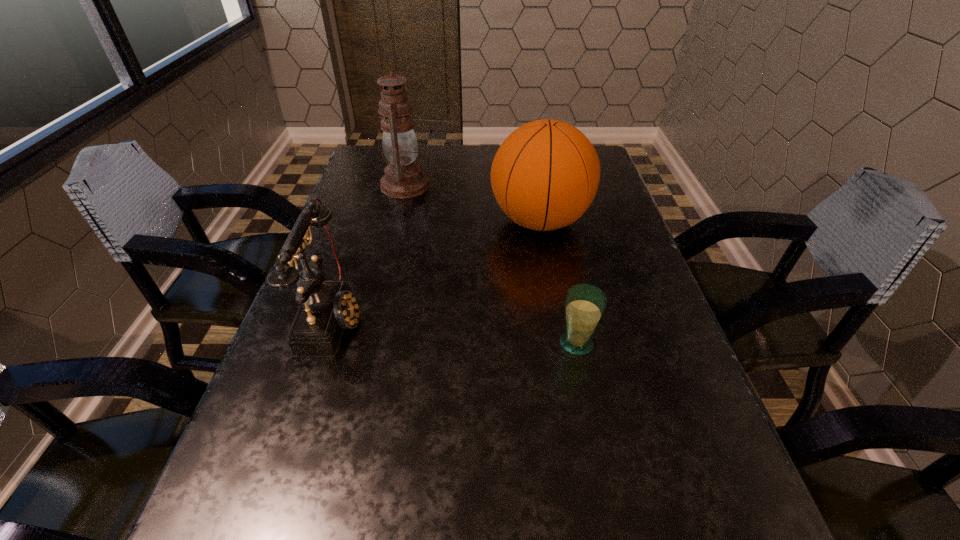
Where is `vacant area that satisfies the following two spatial constraints: 1. on the front side of the basketball; 2. on the dial of the telephone`? The image size is (960, 540). vacant area that satisfies the following two spatial constraints: 1. on the front side of the basketball; 2. on the dial of the telephone is located at coordinates (557, 318).

Where is `free space that satisfies the following two spatial constraints: 1. on the dial of the telephone; 2. on the right side of the glass`? The height and width of the screenshot is (540, 960). free space that satisfies the following two spatial constraints: 1. on the dial of the telephone; 2. on the right side of the glass is located at coordinates (325, 343).

Locate an element on the screen. This screenshot has width=960, height=540. vacant space that satisfies the following two spatial constraints: 1. on the dial of the shortest object; 2. on the right side of the telephone is located at coordinates (325, 343).

You are a GUI agent. You are given a task and a screenshot of the screen. Output one action in this format:
    pyautogui.click(x=<x>, y=<y>)
    Task: Click on the free point that satisfies the following two spatial constraints: 1. on the front side of the basketball; 2. on the dial of the telephone
    This screenshot has width=960, height=540.
    Given the screenshot: What is the action you would take?
    pyautogui.click(x=557, y=318)